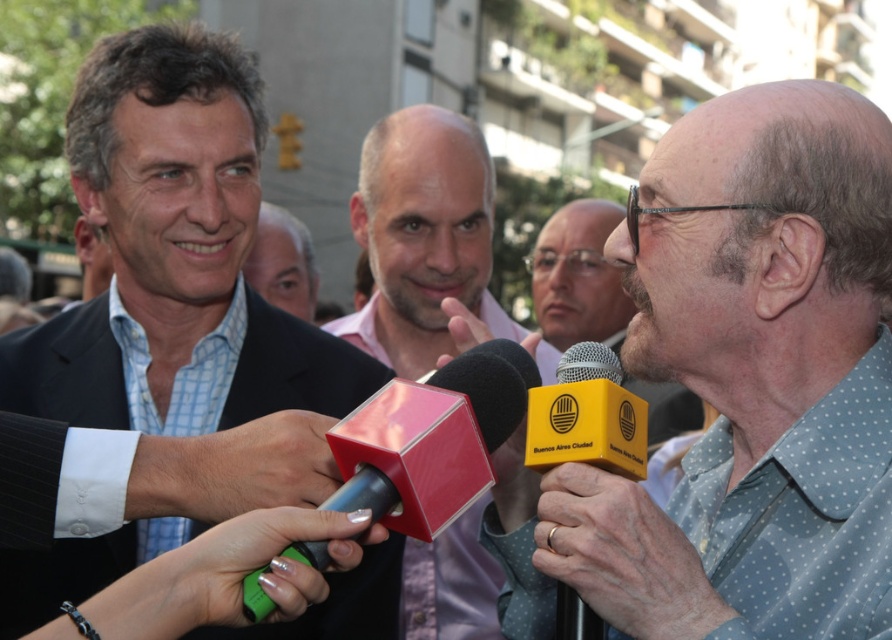
You are a photographer at the event and want to capture a clear shot of both the matte black suit at center and the pink matte microphone at center. Since the camera can only focus on one object at a time, which object should you focus on to ensure the other is still in the background?

You should focus on the matte black suit at center because it is closer to the viewer, and the pink matte microphone at center will naturally be in the background.

You are a photographer at the event and need to capture a photo where both the yellow cardboard microphone at center and the gold metallic ring at upper center are clearly visible. Based on their sizes, which object might appear larger in the photo?

The yellow cardboard microphone at center appears larger in the photo because it is much taller than the gold metallic ring at upper center.

You are attending a press conference and need to hand over a document to the person wearing the matte black suit at center. However, there is a pink matte microphone at center in the way. Can you reach the person without moving the microphone?

The matte black suit at center is located above the pink matte microphone at center, so you can reach the person by going around or above the microphone without needing to move it.